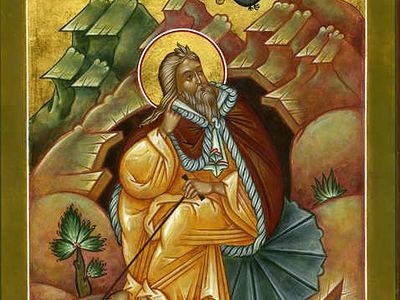
This screenshot has width=400, height=300. What are the coordinates of `red robe` in the screenshot? It's located at tap(262, 147), tap(191, 136).